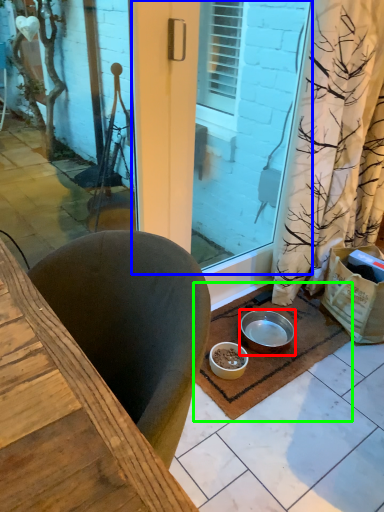
Question: Which object is positioned farthest from bowl (highlighted by a red box)? Select from screen door (highlighted by a blue box) and doormat (highlighted by a green box).

Choices:
 (A) screen door
 (B) doormat

Answer: (A)